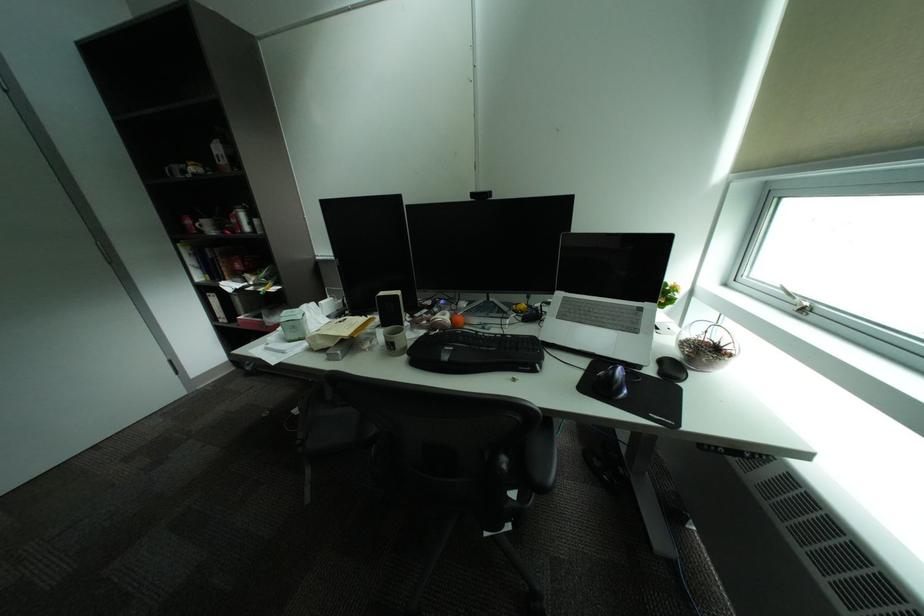
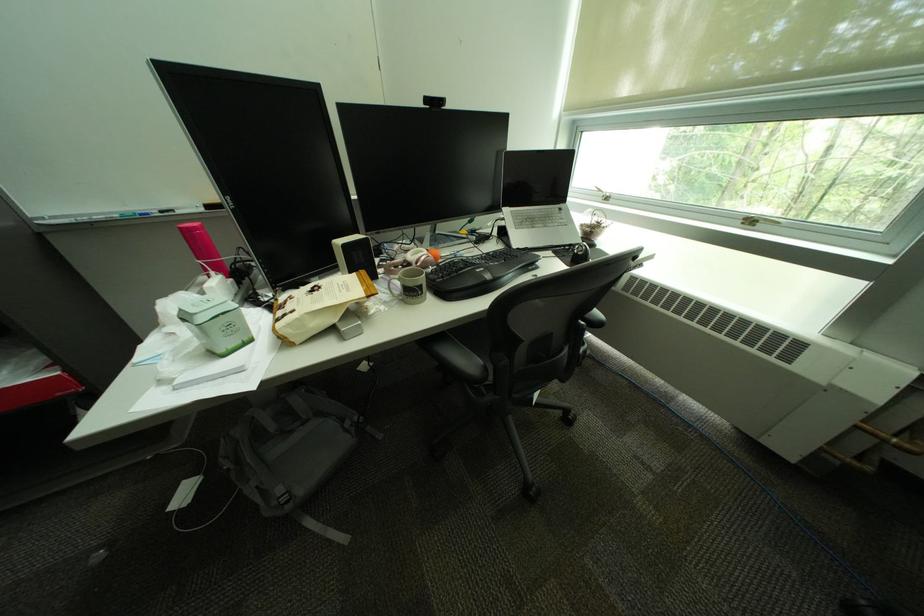
In the second image, find the point that corresponds to (x=561, y=302) in the first image.

(514, 217)